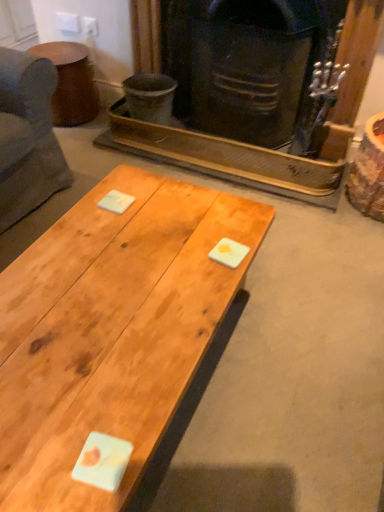
Question: Is point (56, 53) positioned closer to the camera than point (132, 271)?

Choices:
 (A) farther
 (B) closer

Answer: (A)

Question: From the image's perspective, is brown matte side table at upper left positioned above or below natural wood coffee table at center?

Choices:
 (A) below
 (B) above

Answer: (B)

Question: Estimate the real-world distances between objects in this image. Which object is farther from the dark brown wood fireplace at center?

Choices:
 (A) brown matte side table at upper left
 (B) natural wood coffee table at center

Answer: (B)

Question: Which object is the farthest from the natural wood coffee table at center?

Choices:
 (A) brown matte side table at upper left
 (B) dark brown wood fireplace at center

Answer: (A)